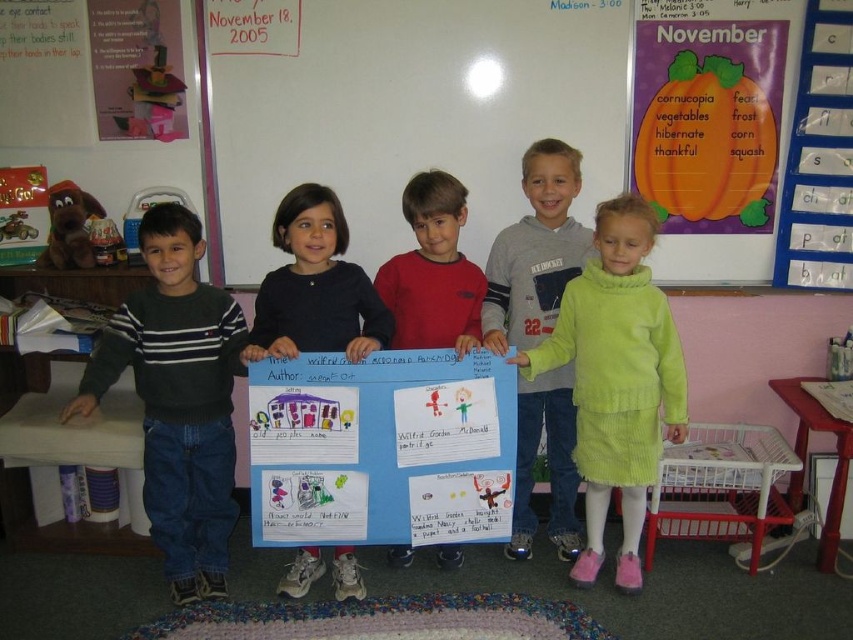
You are standing in the classroom and see two points on the blue poster board. The first point is labeled as point 1 at coordinates point (606, 289), and the second point is labeled as point 2 at coordinates point (569, 451). If you want to touch both points starting from the front of the poster board, which point should you touch first?

Point 1 at coordinates point (606, 289) is in front of point 2 at coordinates point (569, 451), so you should touch point 1 first.

You are a photographer setting up a camera to capture the children holding the blue poster board. You need to ensure both the green corduroy dress at center and the light green sweater at center are fully visible in the frame. Based on their positions, which clothing item might require you to adjust the camera angle to include its full width?

The green corduroy dress at center might require adjusting the camera angle because it is wider than the light green sweater at center, so it could be partially cut off if not framed properly.

You are a photographer positioned at the front of the classroom. You need to take a photo of the children holding the poster. However, you want to ensure that both the dark green sweater at left and the red sweater at center are clearly visible in the photo. Based on their positions, which child should you focus on first to ensure both are in focus?

You should focus on the dark green sweater at left first because it is closer to the viewer than the red sweater at center. By focusing on the closer child, the depth of field may still capture the red sweater at center in focus as well.